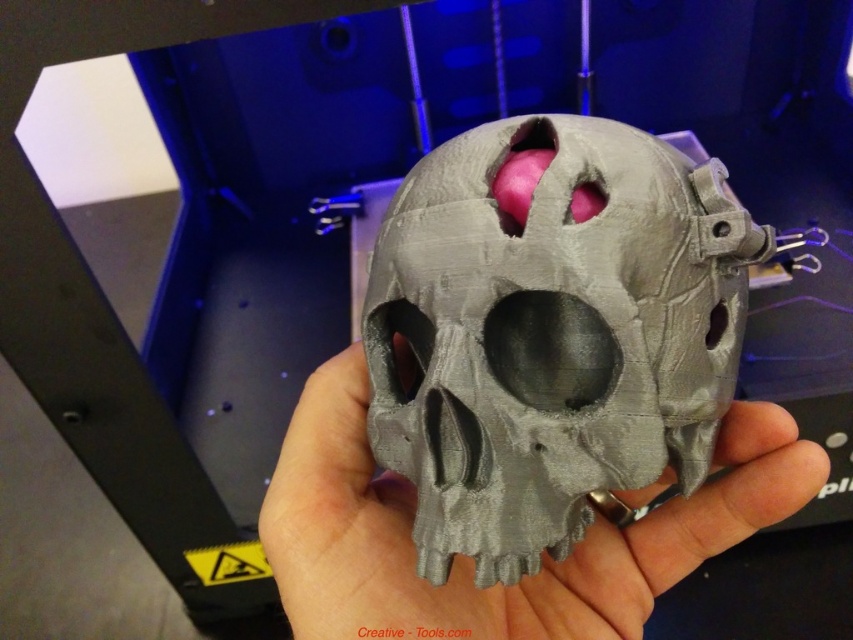
Wait, the two object labels are the same but the first is matte gray and the second is gray matte. Are they different? The description says the first is above the second. But in the scene, there is only one skull. Maybe a typo? Let me check the input again. The user provided Objects as matte gray skull at center and gray matte skull at center. So they are two different objects with the same description but reversed adjectives. The Objects Description says the first is above the second. So the question must

The matte gray skull at center is located above the gray matte skull at center. However, since both objects are described as being at the center, their positioning might be overlapping or arranged vertically with one above the other in the image.

Wait, the objects list has two entries but they seem to be duplicates. Let me check the input again. The user provided two objects labeled as matte gray skull at center and gray matte skull at center. They are slightly different in wording but refer to the same object. However, according to the rules, I must use the exact object labels provided. The Objects Description says the first is much taller than the second, but since they are the same object, this might be an error. Hmm, perhaps it was a typo. Maybe

The Objects Description states that the matte gray skull at center is much taller than the gray matte skull at center, but since both labels refer to the same object, this creates a contradiction. Please verify the input details for accuracy.